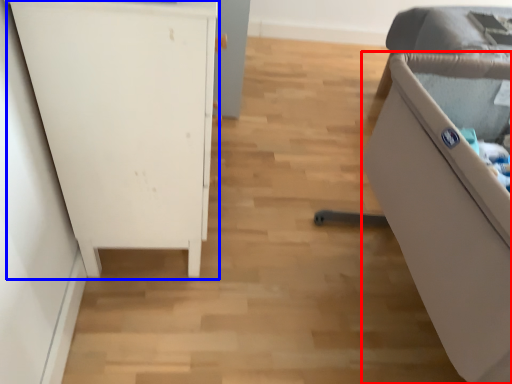
Question: Which point is closer to the camera, furniture (highlighted by a red box) or furniture (highlighted by a blue box)?

Choices:
 (A) furniture
 (B) furniture

Answer: (A)